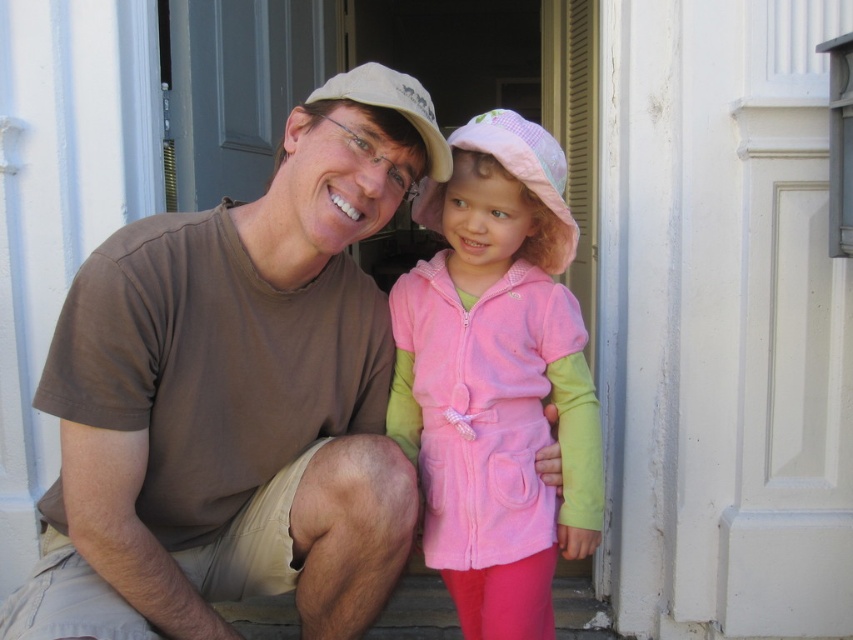
You are a photographer trying to capture a closeup of the pink fleece jacket at center and the matte beige baseball cap at center. Which object should you zoom in on to ensure both are in focus without moving the camera?

The pink fleece jacket at center is larger in size than the matte beige baseball cap at center, so you should zoom in on the pink fleece jacket at center to ensure both are in focus without moving the camera.

You are standing at the point marked by the coordinate point at point (257, 429). The man is sitting to your left and the girl to your right. If you want to give both a high five, which direction should you move first?

Since the man is to your left and the girl to your right, you should move forward to reach both of them for a high five.